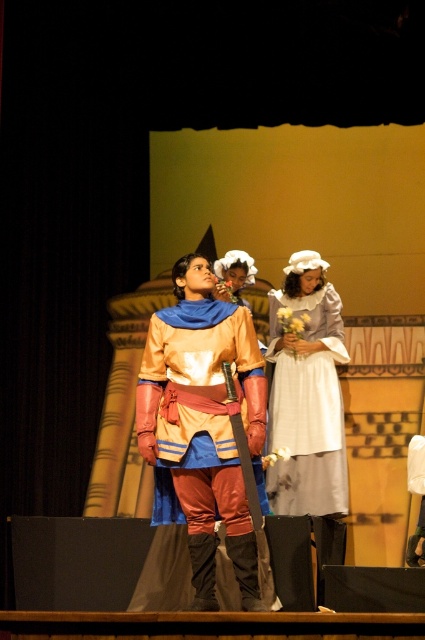
You are designing a stage layout where the matte gold armor at center and the white cotton dress at center need to be placed side by side. Based on their sizes, which object should be positioned first to ensure they both fit on the stage?

The matte gold armor at center might be wider than the white cotton dress at center, so it should be positioned first to accommodate its width.

You are an actor on stage and need to quickly grab the matte gold armor at center before the white cotton dress at center. Which one is closer to your current position if you are standing at the center of the stage?

The matte gold armor at center is to the left of the white cotton dress at center, so if you are standing at the center of the stage, the matte gold armor at center is closer to your current position.

You are an audience member sitting in the front row of the theater. You notice two items on stage at center stage. The first is the matte gold armor at center and the second is the white cotton dress at center. Which item appears larger to you?

The matte gold armor at center appears larger because it is closer to the viewer than the white cotton dress at center.